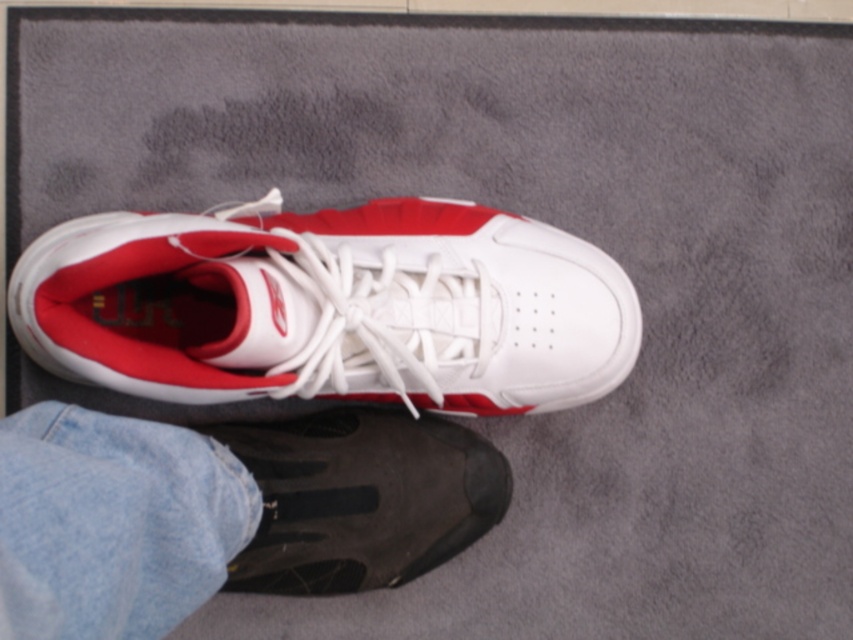
Is white matte/suede sneaker at center to the right of black mesh shoe at lower center from the viewer's perspective?

No, white matte/suede sneaker at center is not to the right of black mesh shoe at lower center.

Does point (456, 316) come closer to viewer compared to point (268, 509)?

No.

Find the location of `white matte/suede sneaker at center`. white matte/suede sneaker at center is located at coordinates (329, 307).

Is point (30, 496) positioned after point (373, 456)?

No, it is not.

Who is more distant from viewer, (187, 484) or (265, 472)?

Point (265, 472)

Between point (419, 429) and point (408, 419), which one is positioned behind?

The point (408, 419) is more distant.

At what (x,y) coordinates should I click in order to perform the action: click on black rubber shoe at lower center. Please return your answer as a coordinate pair (x, y). This screenshot has width=853, height=640. Looking at the image, I should click on (219, 513).

Identify the location of white matte/suede sneaker at center. This screenshot has width=853, height=640. (329, 307).

From the picture: Does white matte/suede sneaker at center lie behind black rubber shoe at lower center?

Yes.

Identify the location of white matte/suede sneaker at center. This screenshot has height=640, width=853. (329, 307).